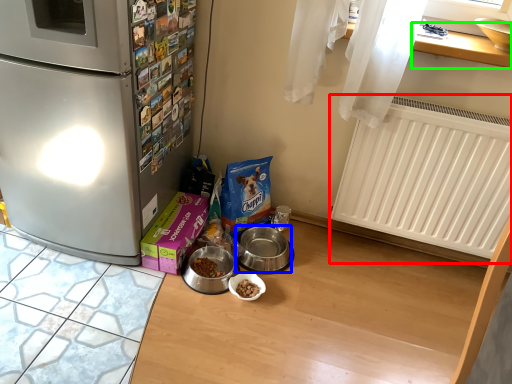
Question: Which object is the farthest from radiator (highlighted by a red box)? Choose among these: appliance (highlighted by a blue box) or window sill (highlighted by a green box).

Choices:
 (A) appliance
 (B) window sill

Answer: (A)